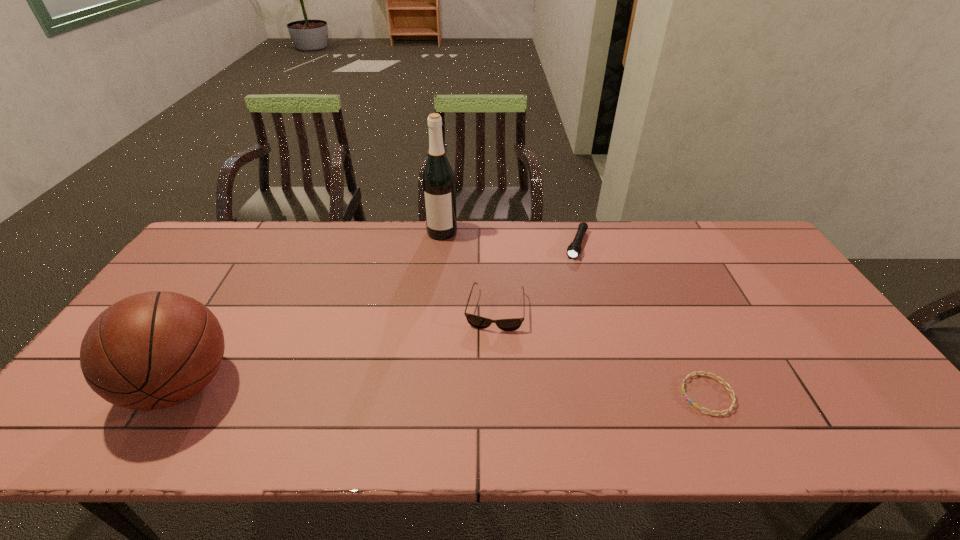
Locate an element on the screen. free space between the flashlight and the wine bottle is located at coordinates (510, 238).

Identify the location of object that can be found as the fourth closest to the tallest object. The width and height of the screenshot is (960, 540). (731, 391).

Identify which object is located as the second nearest to the tallest object. Please provide its 2D coordinates. Your answer should be formatted as a tuple, i.e. [(x, y)], where the tuple contains the x and y coordinates of a point satisfying the conditions above.

[(574, 249)]

This screenshot has width=960, height=540. I want to click on free space that satisfies the following two spatial constraints: 1. on the front side of the second tallest object; 2. on the surface of the rightmost object showing star-shaped elements, so click(177, 395).

Identify the location of free space that satisfies the following two spatial constraints: 1. on the front side of the fourth object from left to right; 2. on the surface of the shortest object showing star-shaped elements. (618, 395).